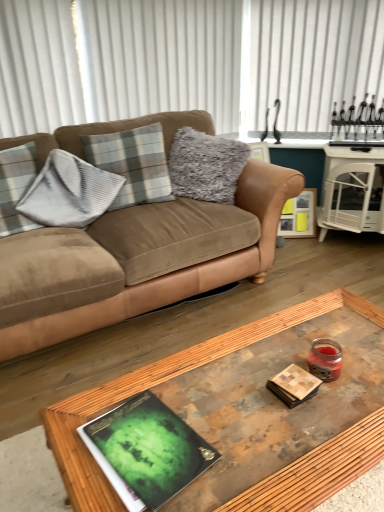
This screenshot has height=512, width=384. In order to click on vacant area that lies between green matte book at center and matte brown book at center in this screenshot , I will do `click(235, 410)`.